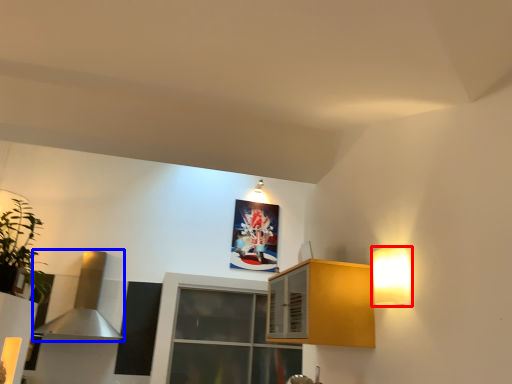
Question: Which object is closer to the camera taking this photo, light fixture (highlighted by a red box) or exhaust hood (highlighted by a blue box)?

Choices:
 (A) light fixture
 (B) exhaust hood

Answer: (A)